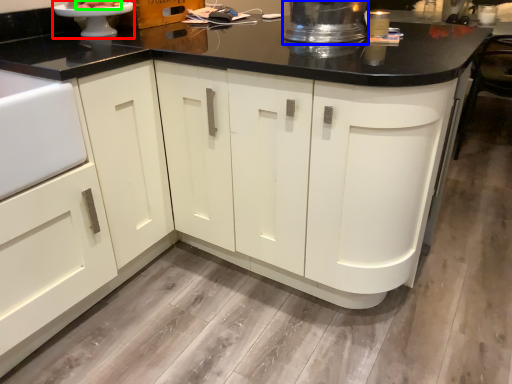
Question: Which object is the farthest from appliance (highlighted by a red box)? Choose among these: appliance (highlighted by a blue box) or food (highlighted by a green box).

Choices:
 (A) appliance
 (B) food

Answer: (A)